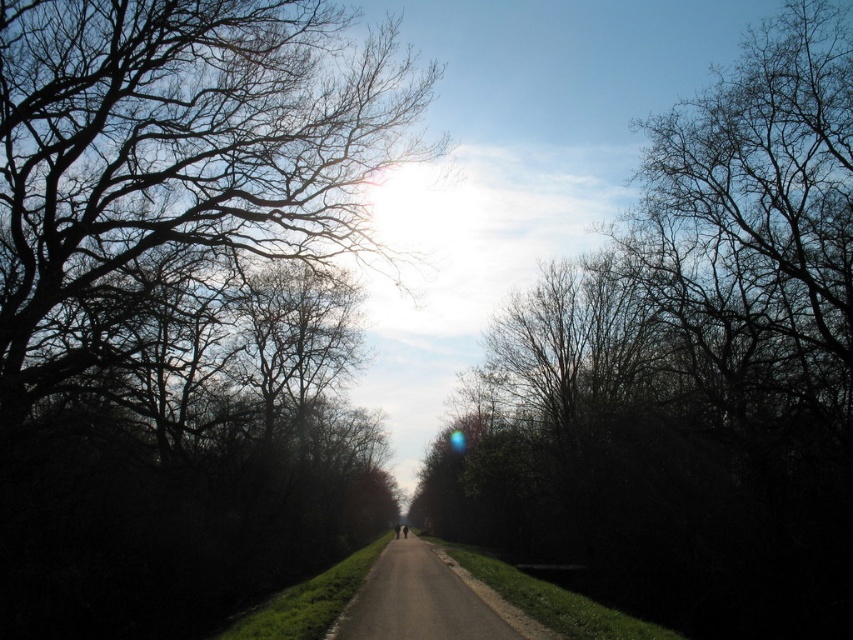
Question: Is silhouette bare tree at center above dark asphalt road at center?

Choices:
 (A) yes
 (B) no

Answer: (A)

Question: Can you confirm if silhouette bare tree at center is thinner than dark asphalt road at center?

Choices:
 (A) no
 (B) yes

Answer: (A)

Question: Which point is closer to the camera?

Choices:
 (A) (502, 628)
 (B) (773, 476)

Answer: (A)

Question: Does silhouette bare tree at center have a larger size compared to dark asphalt road at center?

Choices:
 (A) yes
 (B) no

Answer: (A)